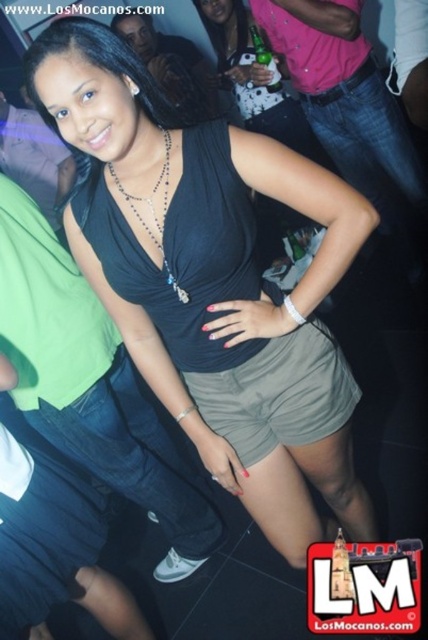
You are a photographer trying to capture the central figure in the nightclub scene. Your camera has a focus point at coordinates 0.417, 0.470. Which object should you aim for to ensure the black matte tank top at center is in focus?

The black matte tank top at center is positioned at point (201, 266), so aiming the camera focus point at those coordinates will ensure it is in focus.

You are a photographer adjusting your camera settings to focus on the black matte tank top at center and the silver beaded necklace at center. Which object should you focus on first to ensure both are in focus?

The black matte tank top at center is closer to the viewer than the silver beaded necklace at center, so focus on the black matte tank top at center first to ensure both are in focus.

Based on the scene description, can you determine which object is taller between the black matte tank top at center and the silver beaded necklace at center?

The black matte tank top at center is much taller than the silver beaded necklace at center.